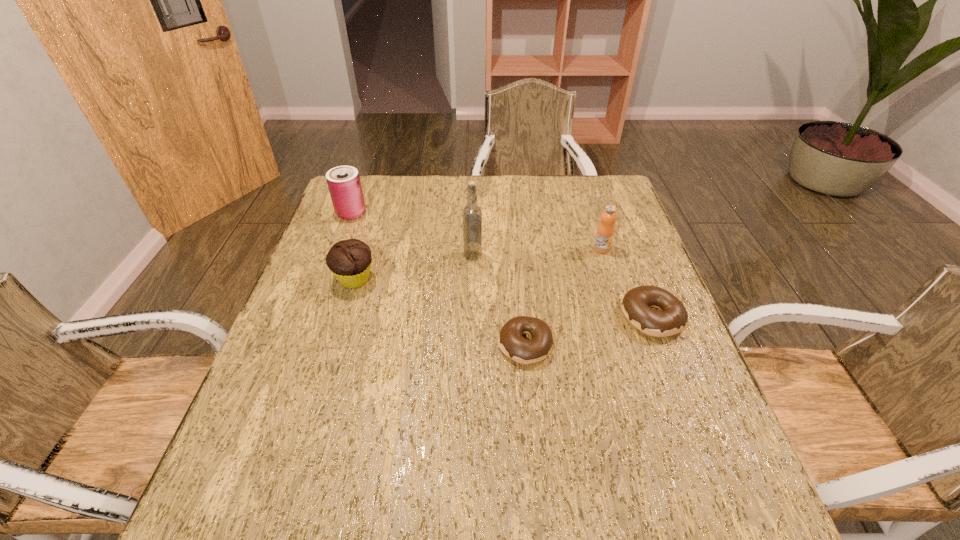
Identify the location of object at the far left corner. This screenshot has width=960, height=540. (344, 184).

This screenshot has height=540, width=960. In order to click on vacant area at the far edge in this screenshot , I will do `click(527, 177)`.

In the image, there is a desktop. At what (x,y) coordinates should I click in order to perform the action: click on vacant space at the near edge. Please return your answer as a coordinate pair (x, y). The height and width of the screenshot is (540, 960). Looking at the image, I should click on (393, 433).

I want to click on free space at the left edge of the desktop, so tap(328, 221).

Locate an element on the screen. The height and width of the screenshot is (540, 960). vacant space at the right edge of the desktop is located at coordinates (656, 338).

In the image, there is a desktop. Identify the location of vacant space at the near left corner. The image size is (960, 540). (280, 464).

The image size is (960, 540). Find the location of `vacant space at the far right corner`. vacant space at the far right corner is located at coordinates (614, 181).

Image resolution: width=960 pixels, height=540 pixels. Identify the location of blank region between the fifth tallest object and the tallest object. (563, 286).

Locate an element on the screen. Image resolution: width=960 pixels, height=540 pixels. free space between the tallest object and the shortest object is located at coordinates (499, 300).

Where is `empty location between the farthest object and the second shortest object`? The height and width of the screenshot is (540, 960). empty location between the farthest object and the second shortest object is located at coordinates (501, 265).